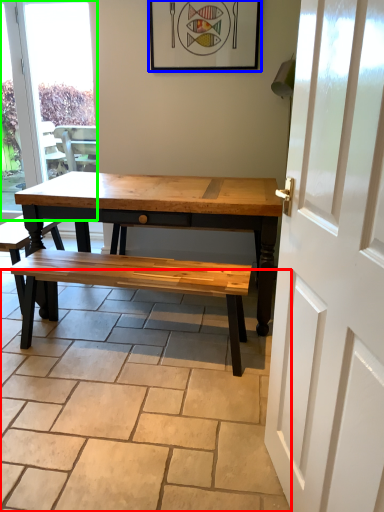
Question: Which is farther away from path (highlighted by a red box)? picture frame (highlighted by a blue box) or window (highlighted by a green box)?

Choices:
 (A) picture frame
 (B) window

Answer: (B)